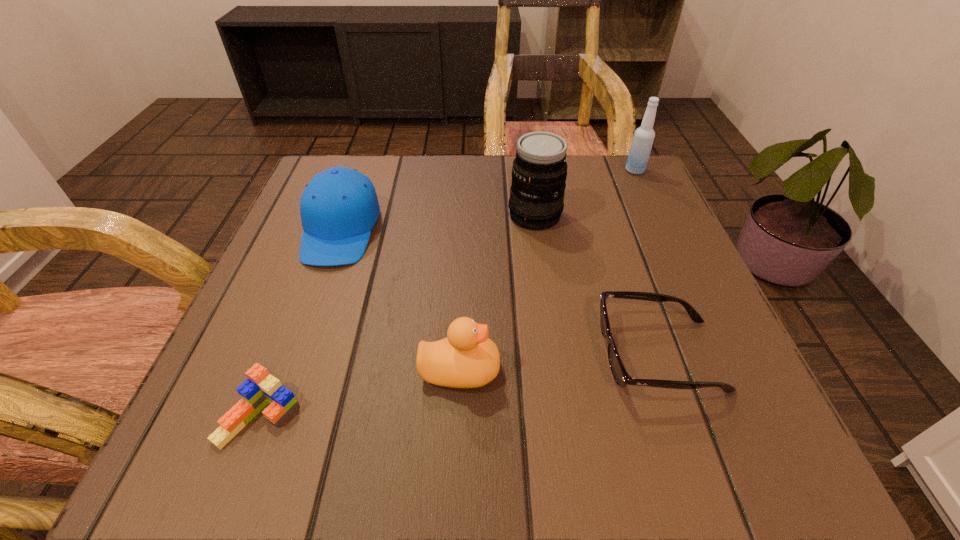
You are a GUI agent. You are given a task and a screenshot of the screen. Output one action in this format:
    pyautogui.click(x=<x>, y=<y>)
    Task: Click on the bottle positioned at the right edge
    
    Given the screenshot: What is the action you would take?
    pyautogui.click(x=642, y=142)

This screenshot has height=540, width=960. In order to click on spectacles at the right edge in this screenshot , I will do click(622, 378).

Where is `object present at the far left corner`? Image resolution: width=960 pixels, height=540 pixels. object present at the far left corner is located at coordinates (x=339, y=207).

This screenshot has width=960, height=540. I want to click on object situated at the near left corner, so click(261, 388).

This screenshot has height=540, width=960. Find the location of `object at the far right corner`. object at the far right corner is located at coordinates (642, 142).

The image size is (960, 540). In the image, there is a desktop. Find the location of `vacant space at the far edge`. vacant space at the far edge is located at coordinates (395, 178).

Identify the location of free space at the near edge. The height and width of the screenshot is (540, 960). (474, 411).

Locate an element on the screen. vacant region at the left edge of the desktop is located at coordinates (279, 347).

This screenshot has height=540, width=960. In order to click on blank space at the right edge in this screenshot , I will do 651,313.

At what (x,y) coordinates should I click in order to perform the action: click on free space at the far left corner of the desktop. Please return your answer as a coordinate pair (x, y). The width and height of the screenshot is (960, 540). Looking at the image, I should click on [x=368, y=169].